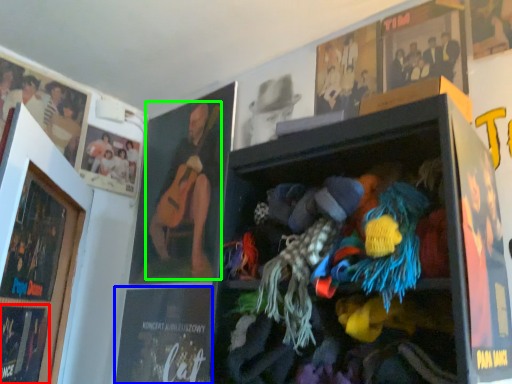
Question: Considering the real-world distances, which object is farthest from magazine (highlighted by a red box)? magazine (highlighted by a blue box) or person (highlighted by a green box)?

Choices:
 (A) magazine
 (B) person

Answer: (B)